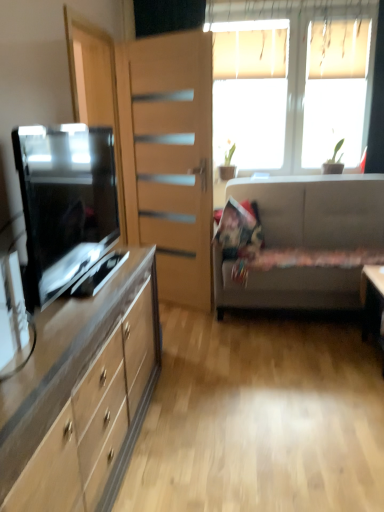
Question: Is green matte plant at upper center positioned before matte wood file cabinet at left?

Choices:
 (A) no
 (B) yes

Answer: (A)

Question: Considering the relative sizes of green matte plant at upper center and matte wood file cabinet at left in the image provided, is green matte plant at upper center wider than matte wood file cabinet at left?

Choices:
 (A) yes
 (B) no

Answer: (A)

Question: Is green matte plant at upper center facing away from matte wood file cabinet at left?

Choices:
 (A) no
 (B) yes

Answer: (A)

Question: Does green matte plant at upper center appear on the left side of matte wood file cabinet at left?

Choices:
 (A) no
 (B) yes

Answer: (A)

Question: Considering the relative sizes of green matte plant at upper center and matte wood file cabinet at left in the image provided, is green matte plant at upper center bigger than matte wood file cabinet at left?

Choices:
 (A) no
 (B) yes

Answer: (A)

Question: Is green matte plant at upper center to the right of matte wood file cabinet at left from the viewer's perspective?

Choices:
 (A) yes
 (B) no

Answer: (A)

Question: Does green matte plant at upper center have a greater height compared to fluffy fabric pillow at center?

Choices:
 (A) no
 (B) yes

Answer: (A)

Question: Does green matte plant at upper center come in front of fluffy fabric pillow at center?

Choices:
 (A) no
 (B) yes

Answer: (A)

Question: Are green matte plant at upper center and fluffy fabric pillow at center located far from each other?

Choices:
 (A) no
 (B) yes

Answer: (A)

Question: Is the position of green matte plant at upper center more distant than that of fluffy fabric pillow at center?

Choices:
 (A) yes
 (B) no

Answer: (A)

Question: Can you confirm if green matte plant at upper center is positioned to the left of fluffy fabric pillow at center?

Choices:
 (A) no
 (B) yes

Answer: (B)

Question: Is green matte plant at upper center oriented towards fluffy fabric pillow at center?

Choices:
 (A) no
 (B) yes

Answer: (B)

Question: Does white plastic window at upper right have a smaller size compared to fluffy fabric pillow at center?

Choices:
 (A) no
 (B) yes

Answer: (A)